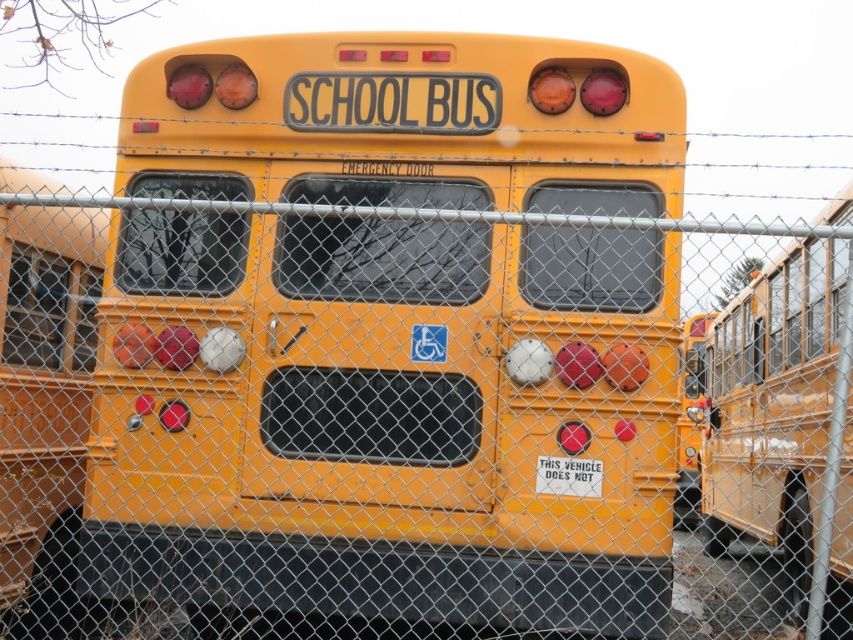
Question: Can you confirm if matte yellow school bus at center is wider than matte yellow school bus at right?

Choices:
 (A) no
 (B) yes

Answer: (B)

Question: Does matte yellow school bus at right come in front of white paper sign at center?

Choices:
 (A) no
 (B) yes

Answer: (A)

Question: Which point is farther from the camera taking this photo?

Choices:
 (A) 310,296
 (B) 578,461

Answer: (A)

Question: Does matte yellow school bus at center appear on the left side of matte yellow school bus at right?

Choices:
 (A) yes
 (B) no

Answer: (A)

Question: Which point is closer to the camera?

Choices:
 (A) matte yellow school bus at center
 (B) white paper sign at center

Answer: (A)

Question: Which point is closer to the camera?

Choices:
 (A) (390, 356)
 (B) (541, 490)
 (C) (704, 524)

Answer: (B)